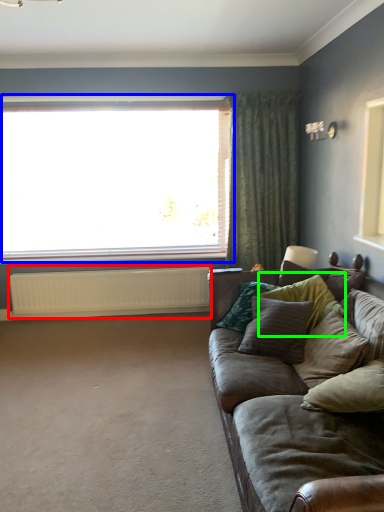
Question: Considering the real-world distances, which object is farthest from radiator (highlighted by a red box)? window (highlighted by a blue box) or pillow (highlighted by a green box)?

Choices:
 (A) window
 (B) pillow

Answer: (B)